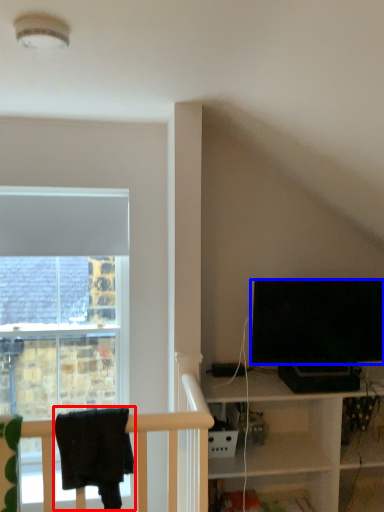
Question: Which object is closer to the camera taking this photo, laundry (highlighted by a red box) or television (highlighted by a blue box)?

Choices:
 (A) laundry
 (B) television

Answer: (A)